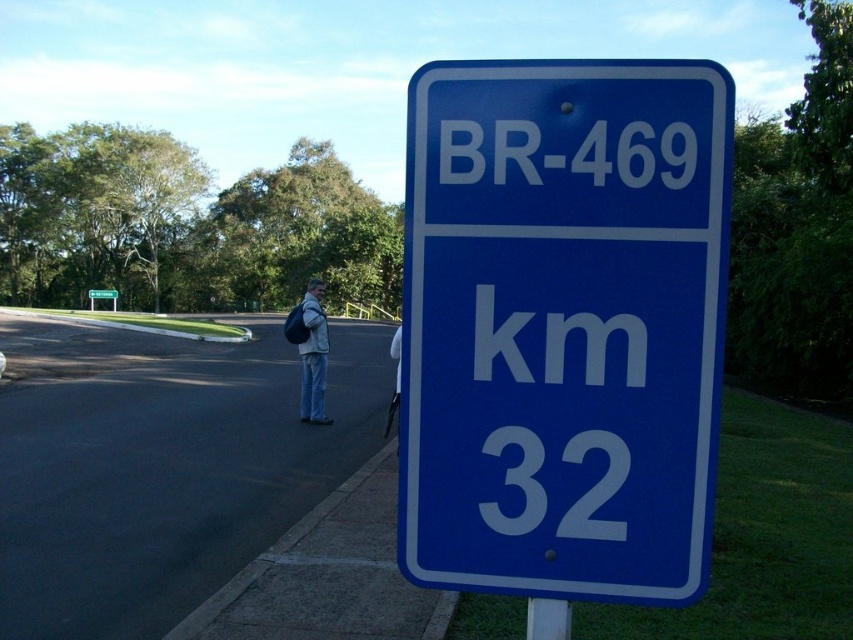
Question: Considering the real-world distances, which object is closest to the blue metallic sign at center?

Choices:
 (A) blue plastic pole at lower center
 (B) green plastic sign at upper center
 (C) light gray jacket at center

Answer: (A)

Question: Can you confirm if blue metallic sign at center is wider than blue plastic pole at lower center?

Choices:
 (A) no
 (B) yes

Answer: (B)

Question: Among these points, which one is farthest from the camera?

Choices:
 (A) (99, 298)
 (B) (631, 451)
 (C) (303, 396)

Answer: (A)

Question: Can you confirm if light gray jacket at center is thinner than blue plastic pole at lower center?

Choices:
 (A) no
 (B) yes

Answer: (A)

Question: Is blue metallic sign at center above blue plastic pole at lower center?

Choices:
 (A) yes
 (B) no

Answer: (A)

Question: Which of the following is the closest to the observer?

Choices:
 (A) (490, 460)
 (B) (537, 637)
 (C) (97, 298)

Answer: (A)